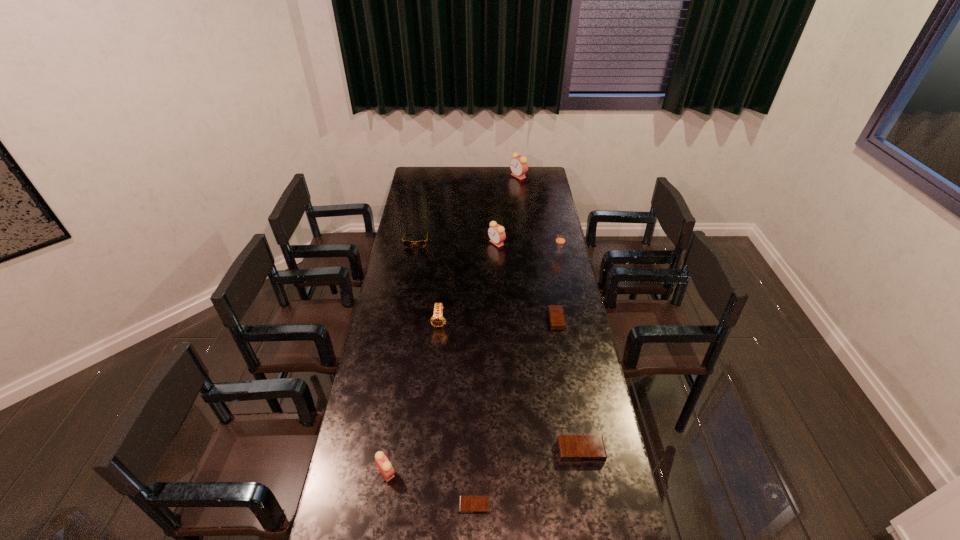
I want to click on vacant region located 0.090m on the front face of the second shortest alarm clock, so pyautogui.click(x=529, y=320).

Find the location of a particular element. This screenshot has width=960, height=540. object that is positioned at the far edge is located at coordinates (518, 165).

I want to click on alarm clock present at the left edge, so click(384, 466).

Image resolution: width=960 pixels, height=540 pixels. In order to click on sunglasses that is at the left edge in this screenshot , I will do `click(421, 243)`.

Locate an element on the screen. straw at the right edge is located at coordinates (560, 240).

You are a GUI agent. You are given a task and a screenshot of the screen. Output one action in this format:
    pyautogui.click(x=<x>, y=<y>)
    Task: Click on the object at the far right corner
    
    Given the screenshot: What is the action you would take?
    pyautogui.click(x=518, y=165)

This screenshot has height=540, width=960. In order to click on free spot at the far edge of the desktop in this screenshot , I will do `click(500, 186)`.

At what (x,y) coordinates should I click in order to perform the action: click on vacant space at the left edge of the desktop. Please return your answer as a coordinate pair (x, y). This screenshot has width=960, height=540. Looking at the image, I should click on (371, 346).

At what (x,y) coordinates should I click in order to perform the action: click on free space at the right edge of the desktop. Please return your answer as a coordinate pair (x, y). Image resolution: width=960 pixels, height=540 pixels. Looking at the image, I should click on (566, 258).

Find the location of `vacant space at the far left corner of the desktop`. vacant space at the far left corner of the desktop is located at coordinates click(423, 181).